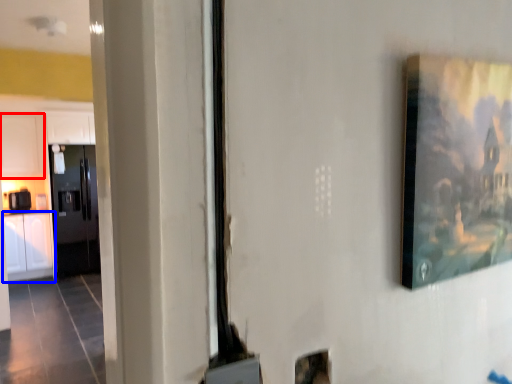
Question: Which point is further to the camera, cabinetry (highlighted by a red box) or cabinetry (highlighted by a blue box)?

Choices:
 (A) cabinetry
 (B) cabinetry

Answer: (A)